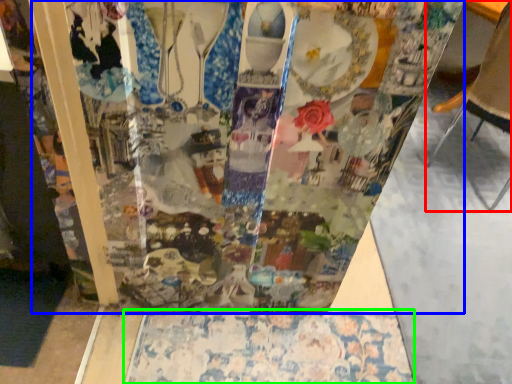
Question: Based on their relative distances, which object is farther from furniture (highlighted by a red box)? Choose from glass box (highlighted by a blue box) and tablecloth (highlighted by a green box).

Choices:
 (A) glass box
 (B) tablecloth

Answer: (B)